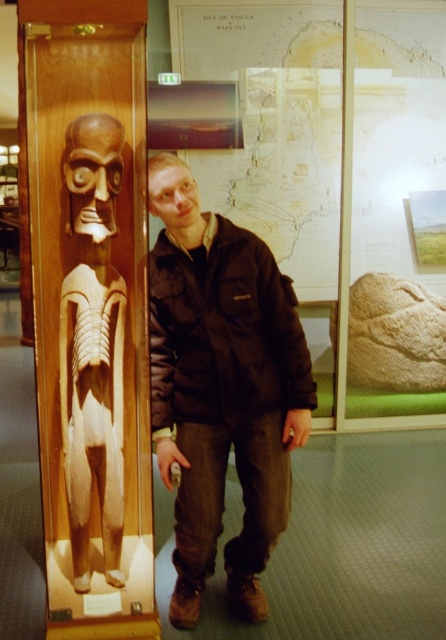
Question: From the image, what is the correct spatial relationship of brown fabric jacket at center in relation to wooden carving at left?

Choices:
 (A) right
 (B) left

Answer: (A)

Question: Which point appears closest to the camera in this image?

Choices:
 (A) (83, 372)
 (B) (252, 554)

Answer: (A)

Question: Where is brown fabric jacket at center located in relation to wooden carving at left in the image?

Choices:
 (A) above
 (B) below

Answer: (B)

Question: Can you confirm if brown fabric jacket at center is positioned to the right of wooden carving at left?

Choices:
 (A) yes
 (B) no

Answer: (A)